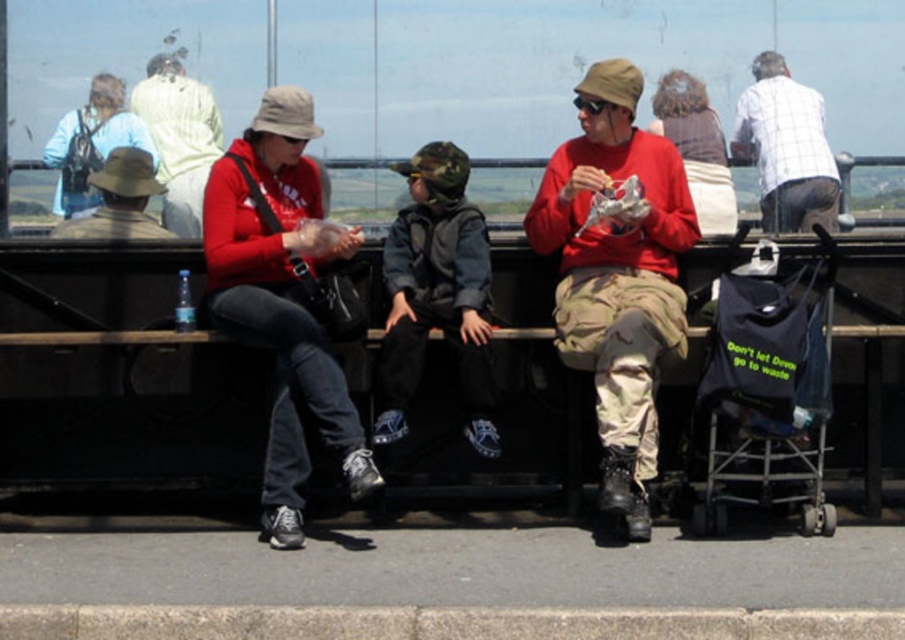
You are a photographer trying to capture a clear shot of the white checkered shirt at upper right and the brown fabric hat at left. Which object should you focus on first if you want to ensure both are in focus without adjusting your camera settings?

The white checkered shirt at upper right is larger in size compared to the brown fabric hat at left, so focusing on the white checkered shirt at upper right first would help ensure both are in focus since it occupies more of the frame.

You are standing in front of the bench where the camo fabric jacket at center and the matte khaki hat at upper left are located. Which object is closer to your left side?

The matte khaki hat at upper left is closer to your left side because the camo fabric jacket at center is positioned to its right.

You are a photographer trying to capture a clear shot of the camo fabric jacket at center and the matte khaki hat at upper left. Since you want both objects to be visible in the frame, which object should you focus on to ensure the larger one is in focus first?

The camo fabric jacket at center has a larger width than the matte khaki hat at upper left, so you should focus on the camo fabric jacket at center first to ensure it is in focus before adjusting for the smaller matte khaki hat at upper left.